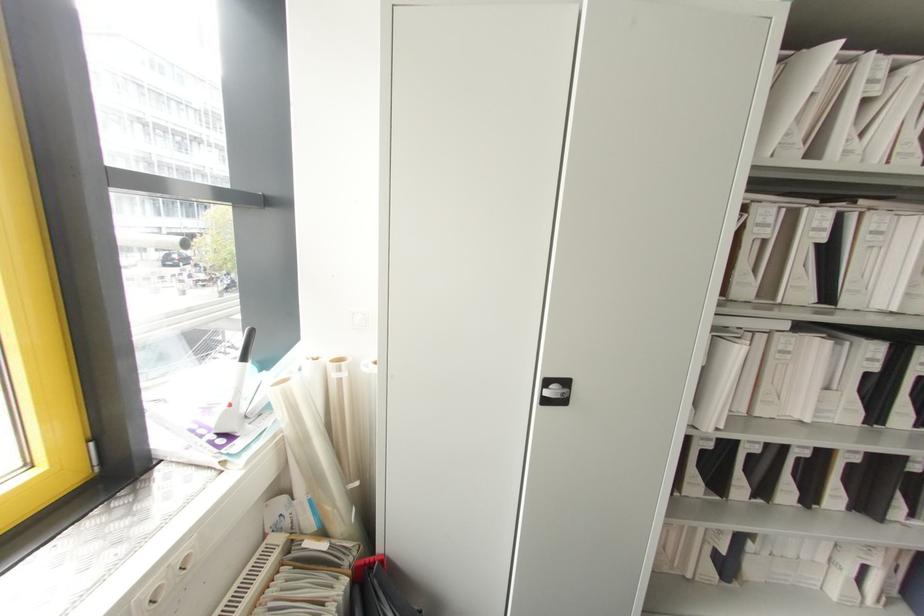
Where would you pull the black cabinet handle? Please return your answer as a coordinate pair (x, y).

(554, 391)